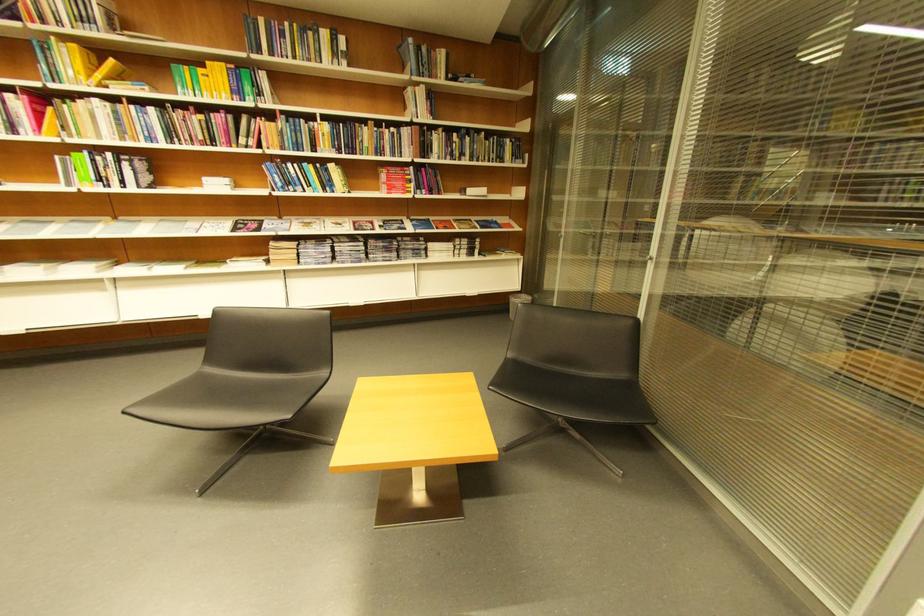
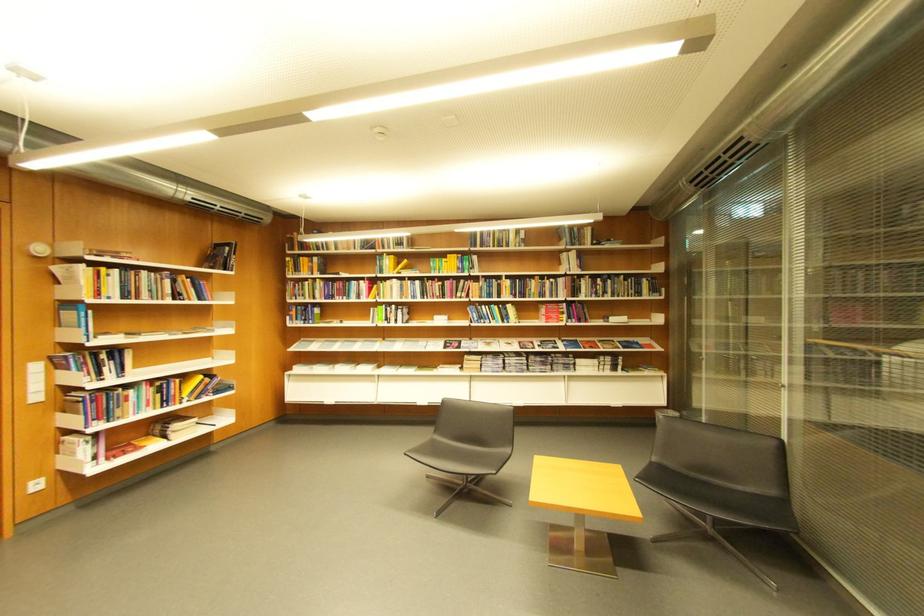
Question: The images are taken continuously from a first-person perspective. In which direction are you moving?

Choices:
 (A) Left
 (B) Right
 (C) Forward
 (D) Backward

Answer: (D)